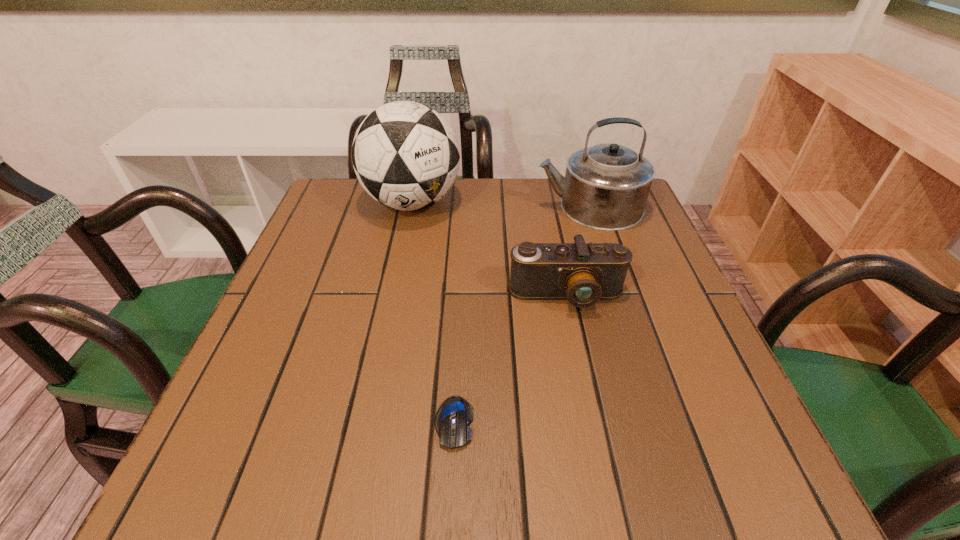
The height and width of the screenshot is (540, 960). I want to click on free space located 0.210m on the lens of the third farthest object, so click(591, 414).

Locate an element on the screen. This screenshot has height=540, width=960. soccer ball at the far edge is located at coordinates (406, 156).

What are the coordinates of `kettle at the far edge` in the screenshot? It's located at (606, 187).

The height and width of the screenshot is (540, 960). In order to click on object present at the near edge in this screenshot , I will do `click(452, 420)`.

Locate an element on the screen. This screenshot has height=540, width=960. object present at the left edge is located at coordinates (406, 156).

Locate an element on the screen. This screenshot has height=540, width=960. kettle present at the right edge is located at coordinates (606, 187).

Image resolution: width=960 pixels, height=540 pixels. I want to click on camera present at the right edge, so click(x=583, y=273).

Identify the location of object located in the far left corner section of the desktop. The width and height of the screenshot is (960, 540). (406, 156).

Identify the location of object at the far right corner. [x=606, y=187].

Where is `vacant space at the near edge of the desktop`? vacant space at the near edge of the desktop is located at coordinates (348, 482).